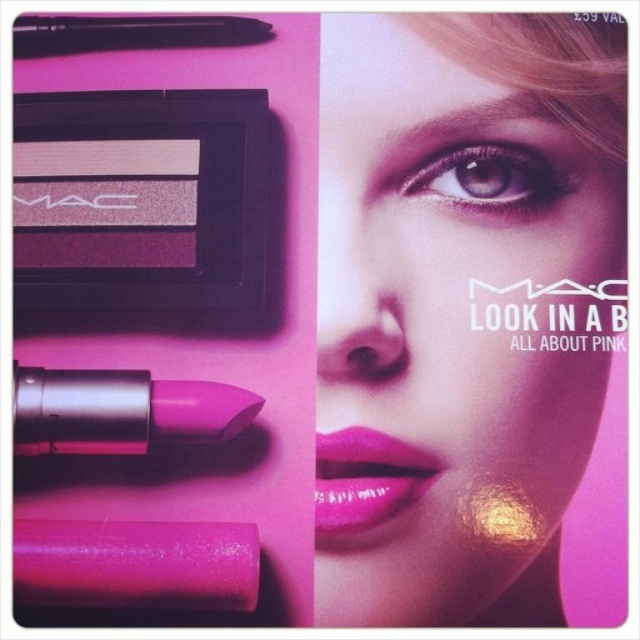
You are a makeup artist who needs to reach both the matte pink lipstick at center and the matte black pen at upper left. Your hand can only reach 12 inches. Can you comfortably reach both items without moving your hand?

The matte pink lipstick at center and matte black pen at upper left are 14.97 inches apart from each other, which is beyond your 12 inches reach. Therefore, you cannot comfortably reach both items without moving your hand.